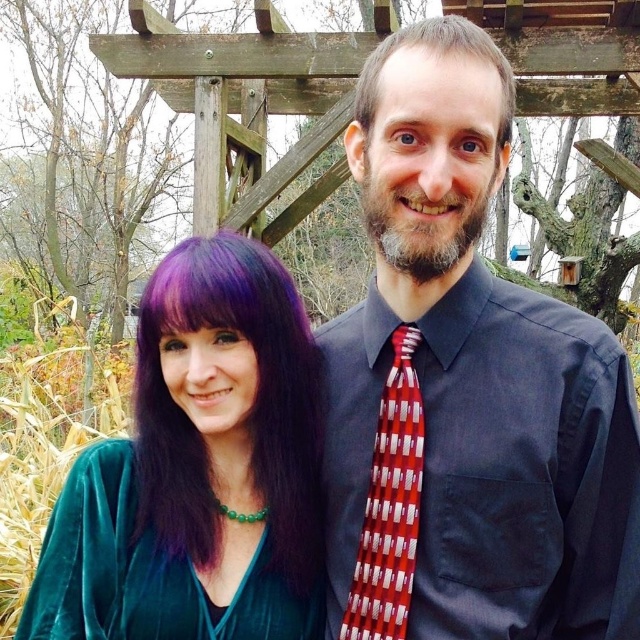
Question: Which object is positioned farthest from the gray matte hair at upper center?

Choices:
 (A) velvet green dress at center
 (B) red striped tie at center
 (C) velvet green dress at left

Answer: (C)

Question: Can you confirm if matte black shirt at center is thinner than velvet green dress at center?

Choices:
 (A) yes
 (B) no

Answer: (A)

Question: Is matte black shirt at center bigger than velvet green dress at center?

Choices:
 (A) no
 (B) yes

Answer: (B)

Question: Does matte black shirt at center appear on the left side of gray matte hair at upper center?

Choices:
 (A) no
 (B) yes

Answer: (B)

Question: Which object is farther from the camera taking this photo?

Choices:
 (A) gray matte hair at upper center
 (B) velvet green dress at left
 (C) red striped tie at center

Answer: (B)

Question: Which point appears farthest from the camera in this image?

Choices:
 (A) (438, 380)
 (B) (392, 499)
 (C) (136, 596)
 (D) (504, 113)

Answer: (C)